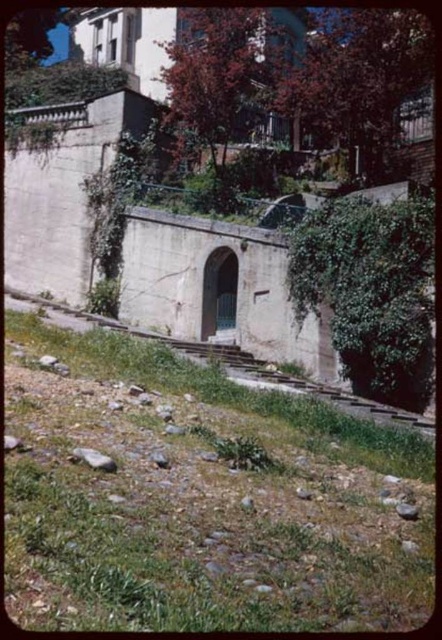
You are standing at the base of the slope in the image and want to reach the arched opening. Which direction should you move to avoid the sparse green grass at lower left represented by point (198, 499)?

To avoid the sparse green grass at lower left represented by point (198, 499), you should move towards the right side of the slope since the grass is located at the lower left point.

You are a gardener assessing the slope for maintenance. You need to place a small decorative statue that requires a flat surface. Which object between the green grass at lower left and the smooth gray rock at lower right would be more suitable for placing the statue?

The smooth gray rock at lower right is more suitable for placing the statue since it has a flat surface, unlike the green grass at lower left which is uneven due to its larger size.

You are a drone operator trying to capture a photo of two specific points in the scene. The first point is labeled as point [141,621] and the second is point [406,518]. Given that you want to ensure both points are in focus, which point should you focus on to maximize the chances of both being sharp?

You should focus on point [406,518] because it is farther away from the camera than point [141,621]. By focusing on the farther point, the near point will also be within the depth of field, ensuring both are sharp.